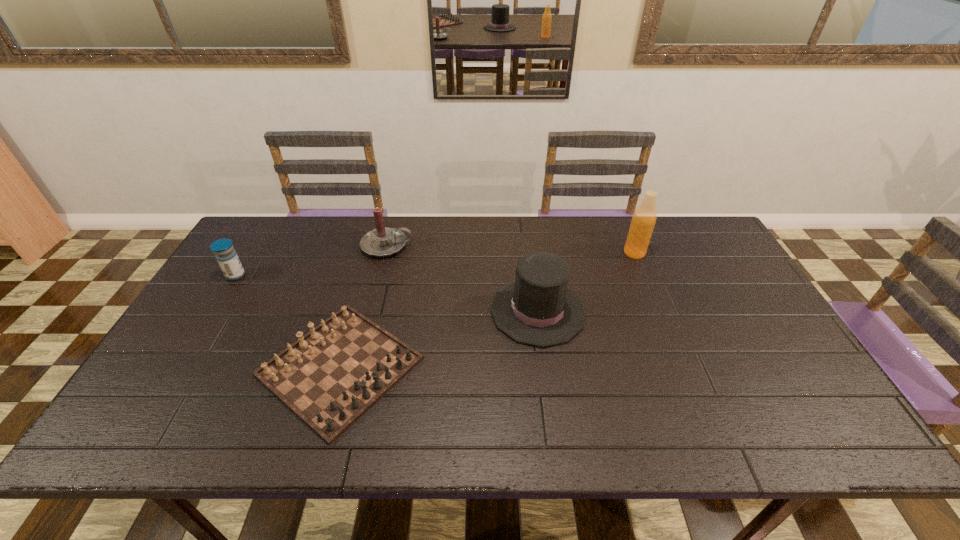
Locate an element on the screen. The width and height of the screenshot is (960, 540). blank region between the tallest object and the fourth tallest object is located at coordinates (435, 264).

Locate an element on the screen. The height and width of the screenshot is (540, 960). unoccupied area between the medicine and the shortest object is located at coordinates (288, 321).

Find the location of a particular element. The width and height of the screenshot is (960, 540). vacant space in between the fourth object from left to right and the beer bottle is located at coordinates (587, 282).

Locate an element on the screen. The width and height of the screenshot is (960, 540). object that is the fourth closest one to the medicine is located at coordinates (643, 221).

Where is `the second closest object to the dress hat`? The image size is (960, 540). the second closest object to the dress hat is located at coordinates (643, 221).

At what (x,y) coordinates should I click in order to perform the action: click on free space in the image that satisfies the following two spatial constraints: 1. on the side of the rightmost object with the handle loop; 2. on the left side of the candle. Please return your answer as a coordinate pair (x, y). This screenshot has width=960, height=540. Looking at the image, I should click on (385, 253).

This screenshot has height=540, width=960. I want to click on free space that satisfies the following two spatial constraints: 1. on the side of the candle with the handle loop; 2. on the left side of the beer bottle, so click(385, 253).

Locate an element on the screen. This screenshot has width=960, height=540. free space that satisfies the following two spatial constraints: 1. on the side of the beer bottle with the handle loop; 2. on the right side of the candle is located at coordinates (385, 253).